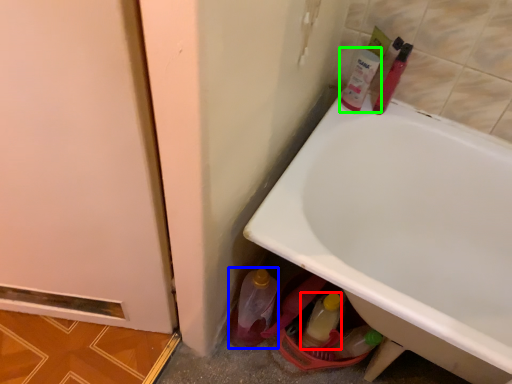
Question: Which object is the farthest from bottle (highlighted by a red box)? Choose among these: bottle (highlighted by a blue box) or mouthwash (highlighted by a green box).

Choices:
 (A) bottle
 (B) mouthwash

Answer: (B)